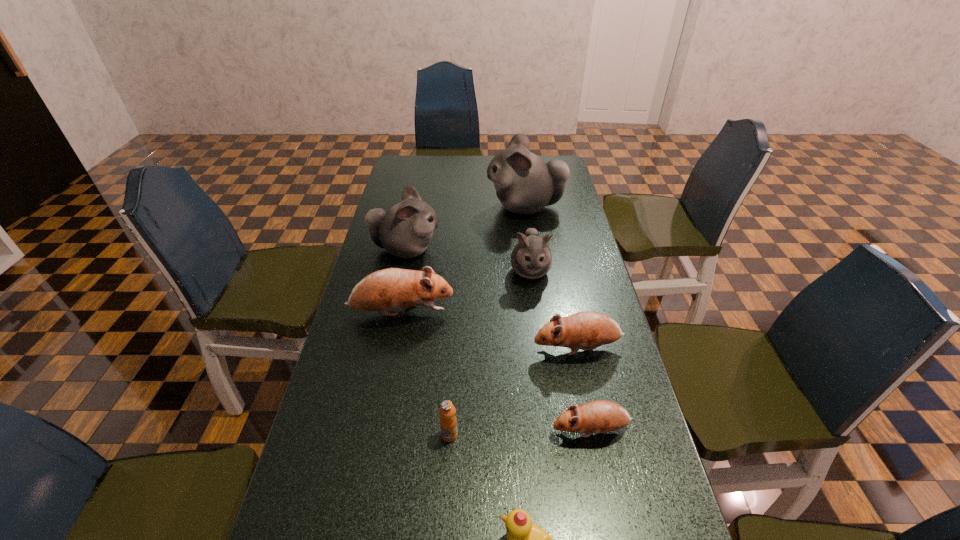
Where is `the tallest object`? the tallest object is located at coordinates (525, 184).

Identify the location of the biggest white hamster. (525, 184).

The image size is (960, 540). I want to click on the seventh shortest object, so click(x=405, y=230).

I want to click on the leftmost white hamster, so click(x=405, y=230).

Where is `the smallest white hamster`? This screenshot has height=540, width=960. the smallest white hamster is located at coordinates (531, 258).

The image size is (960, 540). Find the location of `the third nearest hamster`. the third nearest hamster is located at coordinates (393, 288).

The image size is (960, 540). In order to click on the leftmost brown hamster in this screenshot , I will do `click(393, 288)`.

Find the location of a particular element. This screenshot has height=540, width=960. the second farthest brown hamster is located at coordinates (587, 330).

The width and height of the screenshot is (960, 540). Identify the location of the second smallest brown hamster. (587, 330).

Identify the location of orange juice. point(448,422).